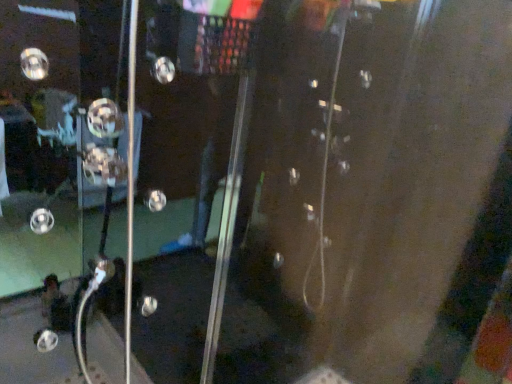
Consider the image. In order to face transparent glass screen door at left, should I rotate leftwards or rightwards?

You should rotate left by 11.926 degrees.

The image size is (512, 384). What are the coordinates of `transparent glass screen door at left` in the screenshot? It's located at (209, 42).

What do you see at coordinates (209, 42) in the screenshot?
I see `transparent glass screen door at left` at bounding box center [209, 42].

What do you see at coordinates (155, 200) in the screenshot?
I see `metallic knob at center` at bounding box center [155, 200].

Where is `metallic knob at center`? The image size is (512, 384). metallic knob at center is located at coordinates (155, 200).

Find the location of a particular element. transparent glass screen door at left is located at coordinates (209, 42).

Which is more to the right, metallic knob at center or transparent glass screen door at left?

Positioned to the right is transparent glass screen door at left.

Is metallic knob at center behind transparent glass screen door at left?

Yes, metallic knob at center is behind transparent glass screen door at left.

Which is nearer, (152, 199) or (169, 41)?

The point (169, 41) is in front.

From the image's perspective, between metallic knob at center and transparent glass screen door at left, which one is located above?

metallic knob at center.

From a real-world perspective, is metallic knob at center positioned under transparent glass screen door at left based on gravity?

No, from a real-world perspective, metallic knob at center is not beneath transparent glass screen door at left.

Considering the sizes of metallic knob at center and transparent glass screen door at left in the image, is metallic knob at center wider or thinner than transparent glass screen door at left?

Clearly, metallic knob at center has less width compared to transparent glass screen door at left.

Can you confirm if metallic knob at center is shorter than transparent glass screen door at left?

Yes.

Considering the sizes of objects metallic knob at center and transparent glass screen door at left in the image provided, who is smaller, metallic knob at center or transparent glass screen door at left?

metallic knob at center is smaller.

Is metallic knob at center not within transparent glass screen door at left?

No, metallic knob at center is not entirely external to transparent glass screen door at left.

Is metallic knob at center positioned far away from transparent glass screen door at left?

No, metallic knob at center is not far away from transparent glass screen door at left.

Is metallic knob at center turned away from transparent glass screen door at left?

Yes, transparent glass screen door at left is at the back of metallic knob at center.

How much distance is there between metallic knob at center and transparent glass screen door at left?

26.87 centimeters.

Locate an element on the screen. screen door on the right of the metallic knob at center is located at coordinates (209, 42).

Does transparent glass screen door at left appear on the left side of metallic knob at center?

No, transparent glass screen door at left is not to the left of metallic knob at center.

Looking at this image, is the position of transparent glass screen door at left more distant than that of metallic knob at center?

No, transparent glass screen door at left is closer to the viewer.

Between point (191, 53) and point (149, 208), which one is positioned in front?

Positioned in front is point (191, 53).

Based on the photo, from the image's perspective, is transparent glass screen door at left above or below metallic knob at center?

From the image's perspective, transparent glass screen door at left appears below metallic knob at center.

From a real-world perspective, between transparent glass screen door at left and metallic knob at center, who is vertically higher?

From a 3D spatial view, metallic knob at center is above.

Which of these two, transparent glass screen door at left or metallic knob at center, is thinner?

metallic knob at center.

Considering the relative sizes of transparent glass screen door at left and metallic knob at center in the image provided, is transparent glass screen door at left taller than metallic knob at center?

Correct, transparent glass screen door at left is much taller as metallic knob at center.

Based on their sizes in the image, would you say transparent glass screen door at left is bigger or smaller than metallic knob at center?

Clearly, transparent glass screen door at left is larger in size than metallic knob at center.

Would you say transparent glass screen door at left is inside or outside metallic knob at center?

transparent glass screen door at left is spatially situated outside metallic knob at center.

Are transparent glass screen door at left and metallic knob at center making contact?

transparent glass screen door at left is not next to metallic knob at center, and they're not touching.

Is transparent glass screen door at left facing away from metallic knob at center?

No, transparent glass screen door at left's orientation is not away from metallic knob at center.

There is a transparent glass screen door at left. Where is `knob above it (from a real-world perspective)`? This screenshot has width=512, height=384. knob above it (from a real-world perspective) is located at coordinates (155, 200).

Where is `knob on the left of transparent glass screen door at left`? This screenshot has width=512, height=384. knob on the left of transparent glass screen door at left is located at coordinates tap(155, 200).

Locate an element on the screen. screen door below the metallic knob at center (from a real-world perspective) is located at coordinates (209, 42).